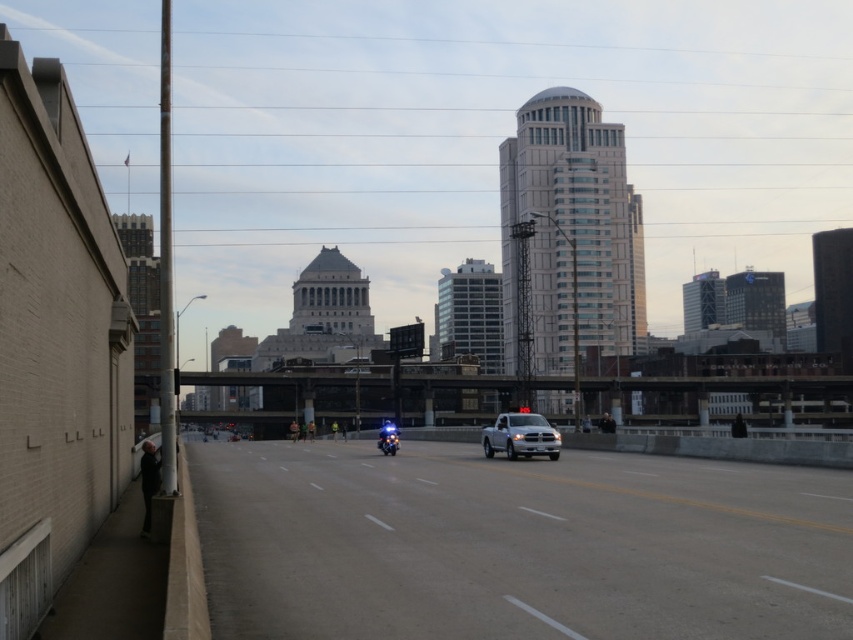
Looking at this image, you are a delivery driver navigating through the city. You need to deliver a package to a location marked by point (520, 445) and then to another location marked by point (384, 438). Based on the scene, which point should you visit first to follow the most logical route?

You should visit point (520, 445) first because it is in front of point (384, 438), so it is closer to your current position.

What is located at the coordinates point (x=515, y=545) in the image?

The point (x=515, y=545) corresponds to the gray asphalt highway at center.